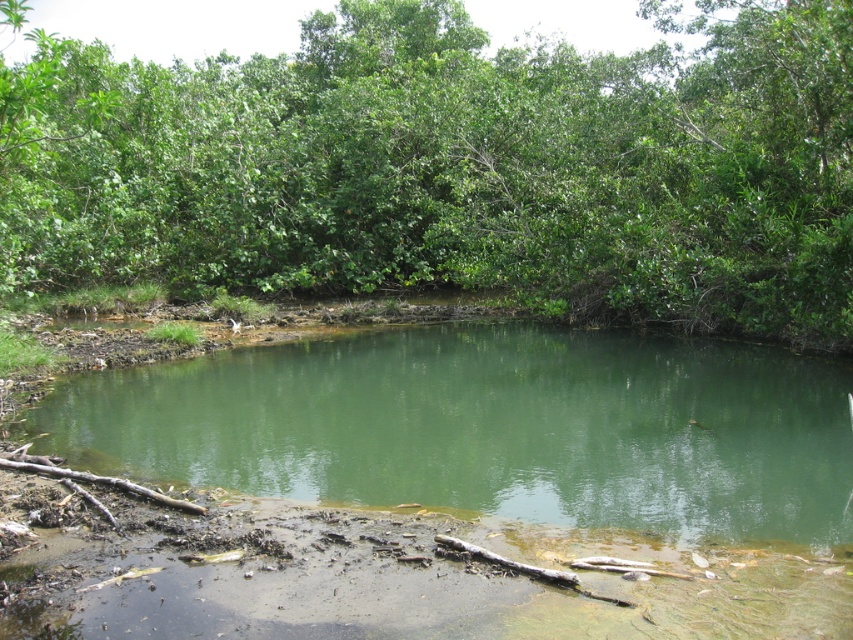
You are a bird flying over the pond. You want to land on the nearest object. Which object should you choose between the green leafy tree at upper center and the green muddy water at center?

The green leafy tree at upper center is much taller than the green muddy water at center, so you should land on the green leafy tree at upper center because it is higher and provides a stable landing spot.

You are a bird flying over the green leafy tree at upper center and the green muddy water at center. Which object is directly above the other?

The green leafy tree at upper center is positioned over green muddy water at center.

You are standing at the center of the pond and looking towards the edge. Which direction should you go to reach the green leafy tree at upper center located at point [454,168]?

The green leafy tree at upper center is located at point [454,168], so you should head towards the upper center direction to reach it.